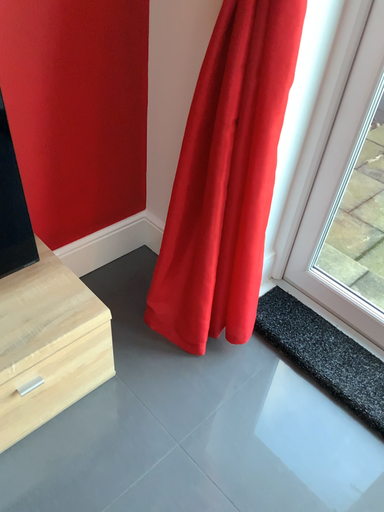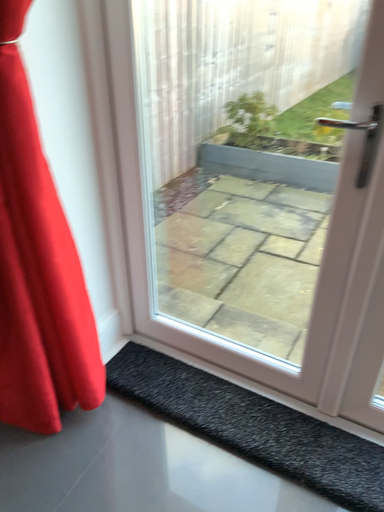
Question: How did the camera likely rotate when shooting the video?

Choices:
 (A) rotated downward
 (B) rotated upward

Answer: (B)